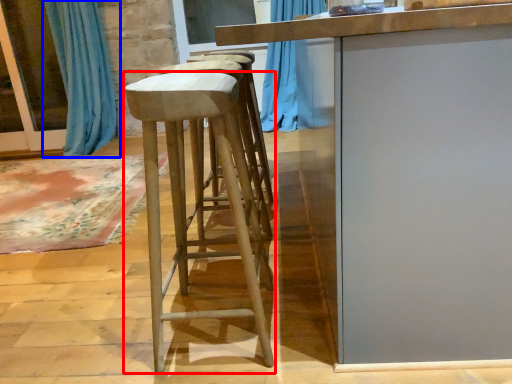
Question: Which of the following is the closest to the observer, stool (highlighted by a red box) or curtain (highlighted by a blue box)?

Choices:
 (A) stool
 (B) curtain

Answer: (A)